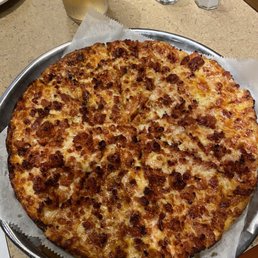
I want to click on table, so click(225, 36).